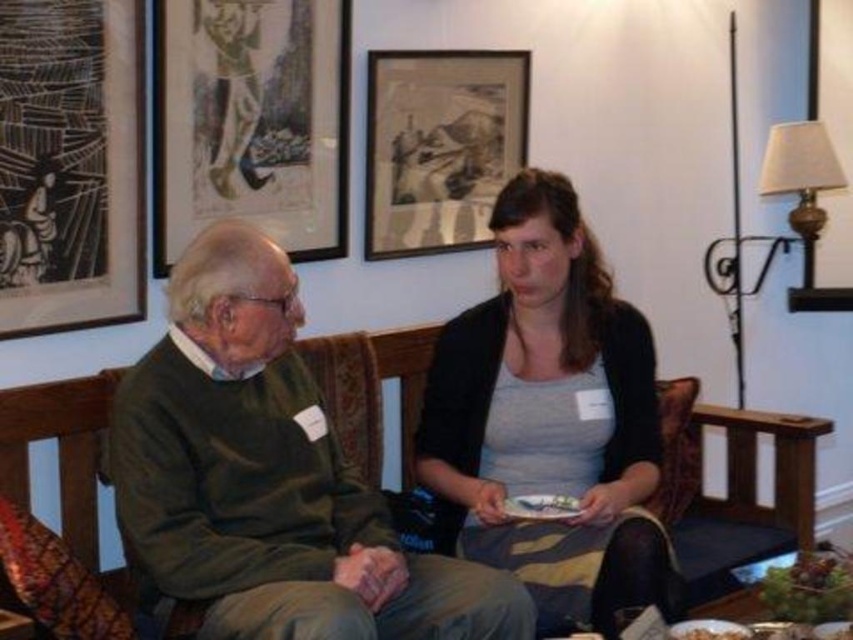
You are standing in the room and want to hang a new painting on the wall. The current black paper picture frame at upper left is at coordinates point (70,164). If you want to place a new painting 10 cm to the right of the black paper picture frame at upper left, what coordinates should you use?

The new painting should be placed at coordinates point 0.358, 0.083, since adding 0.1 to the x coordinate moves it 10 cm to the right.

You are an interior designer assessing the layout of this room. The green sweater at center and the black paper picture frame at upper left are both in your line of sight. Which object is closer to you?

The green sweater at center is closer to you because it is in front of the black paper picture frame at upper left.

You are an interior designer planning to hang two artworks in a hallway. The matte paper picture frame at upper center and the wooden framed artwork at upper center must be spaced exactly 15 inches apart. Given their current spacing in the image, do you need to adjust their positions?

The matte paper picture frame at upper center and wooden framed artwork at upper center are currently 14.79 inches apart. Since the required spacing is 15 inches, you need to increase the distance between them by 0.21 inches to meet the requirement.